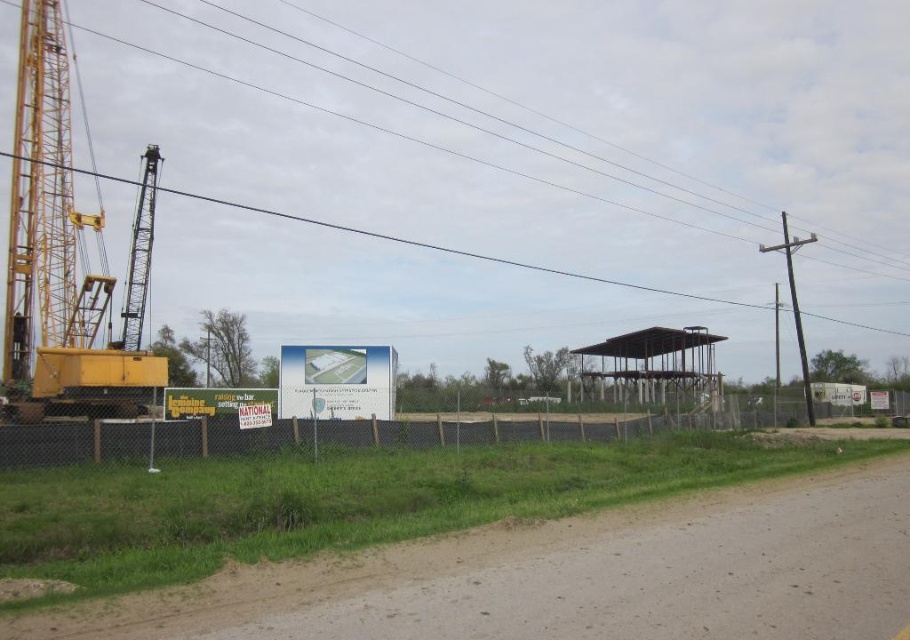
Does yellow metallic crane at left have a greater width compared to black chain-link fence at center?

No.

Is yellow metallic crane at left smaller than black chain-link fence at center?

Incorrect, yellow metallic crane at left is not smaller in size than black chain-link fence at center.

The image size is (910, 640). Find the location of `yellow metallic crane at left`. yellow metallic crane at left is located at coordinates (46, 204).

Is black chain-link fence at center above metallic wire at upper center?

Actually, black chain-link fence at center is below metallic wire at upper center.

Who is positioned more to the right, black chain-link fence at center or metallic wire at upper center?

black chain-link fence at center

Does point (615, 422) come behind point (79, 168)?

That is False.

Where is `black chain-link fence at center`? This screenshot has width=910, height=640. black chain-link fence at center is located at coordinates (143, 440).

Is metallic wire at upper center thinner than smooth gray pole at right?

In fact, metallic wire at upper center might be wider than smooth gray pole at right.

Is metallic wire at upper center positioned at the back of smooth gray pole at right?

Yes, it is behind smooth gray pole at right.

Is point (339, 227) more distant than point (794, 243)?

Yes, it is behind point (794, 243).

Where is `metallic wire at upper center`? Image resolution: width=910 pixels, height=640 pixels. metallic wire at upper center is located at coordinates (457, 250).